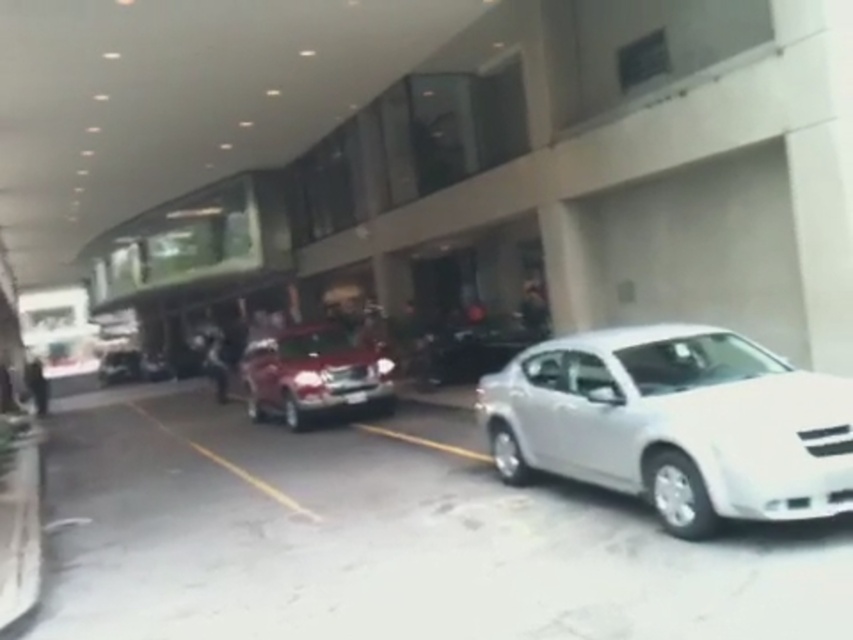
Question: Which point is farther from the camera taking this photo?

Choices:
 (A) (306, 397)
 (B) (743, 445)

Answer: (A)

Question: Can you confirm if white glossy sedan at center is bigger than shiny silver sedan at center?

Choices:
 (A) yes
 (B) no

Answer: (B)

Question: Estimate the real-world distances between objects in this image. Which object is closer to the shiny silver sedan at center?

Choices:
 (A) white glossy sedan at center
 (B) shiny silver car at center

Answer: (A)

Question: Is shiny red car at center further to camera compared to shiny silver sedan at center?

Choices:
 (A) no
 (B) yes

Answer: (A)

Question: Can you confirm if shiny red car at center is positioned above shiny silver sedan at center?

Choices:
 (A) yes
 (B) no

Answer: (B)

Question: Which point is closer to the camera?

Choices:
 (A) (126, 356)
 (B) (515, 340)
 (C) (618, 355)
 (D) (386, 371)

Answer: (C)